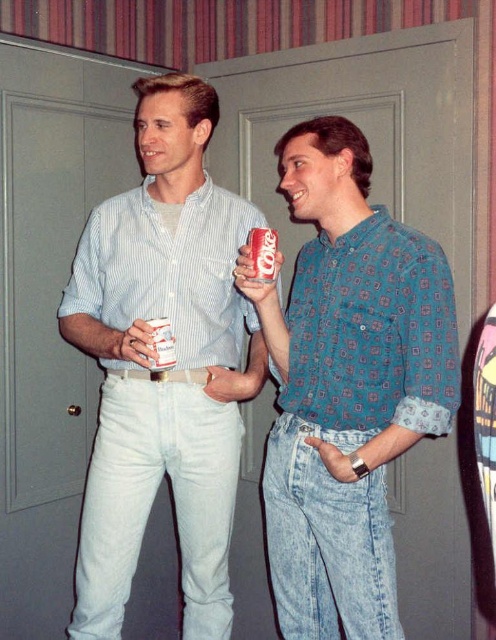
Between blue printed shirt at center and light blue striped shirt at center, which one is positioned higher?

light blue striped shirt at center is higher up.

Is blue printed shirt at center closer to the viewer compared to light blue striped shirt at center?

That is True.

Locate an element on the screen. The width and height of the screenshot is (496, 640). blue printed shirt at center is located at coordinates (347, 385).

At what (x,y) coordinates should I click in order to perform the action: click on light blue striped shirt at center. Please return your answer as a coordinate pair (x, y). Looking at the image, I should click on (163, 372).

Is light blue striped shirt at center further to the viewer compared to white paper cup at center?

Yes, light blue striped shirt at center is further from the viewer.

Identify the location of light blue striped shirt at center. (163, 372).

Which is more to the right, blue printed shirt at center or matte plastic can at center?

From the viewer's perspective, blue printed shirt at center appears more on the right side.

Does point (328, 458) lie behind point (274, 276)?

No, it is not.

This screenshot has width=496, height=640. I want to click on blue printed shirt at center, so click(x=347, y=385).